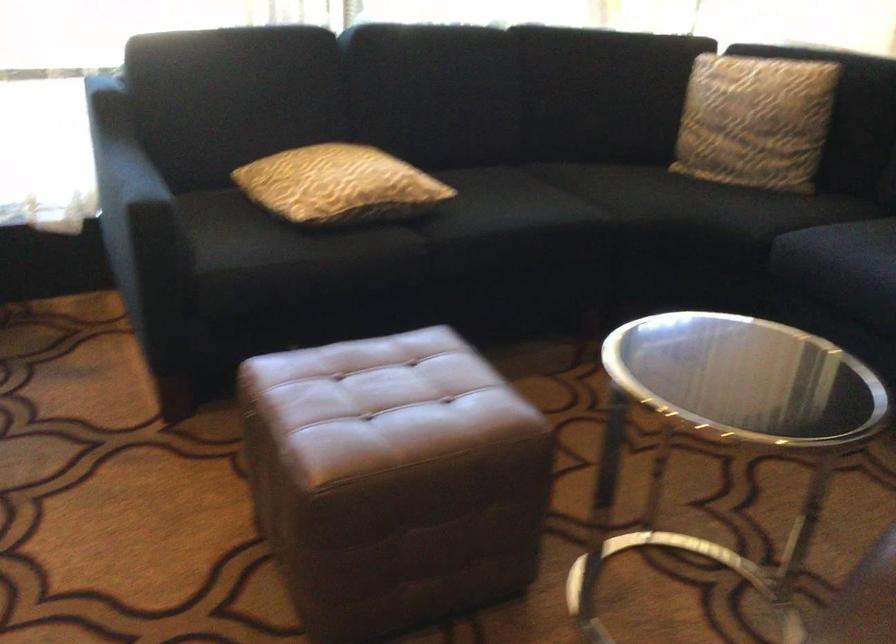
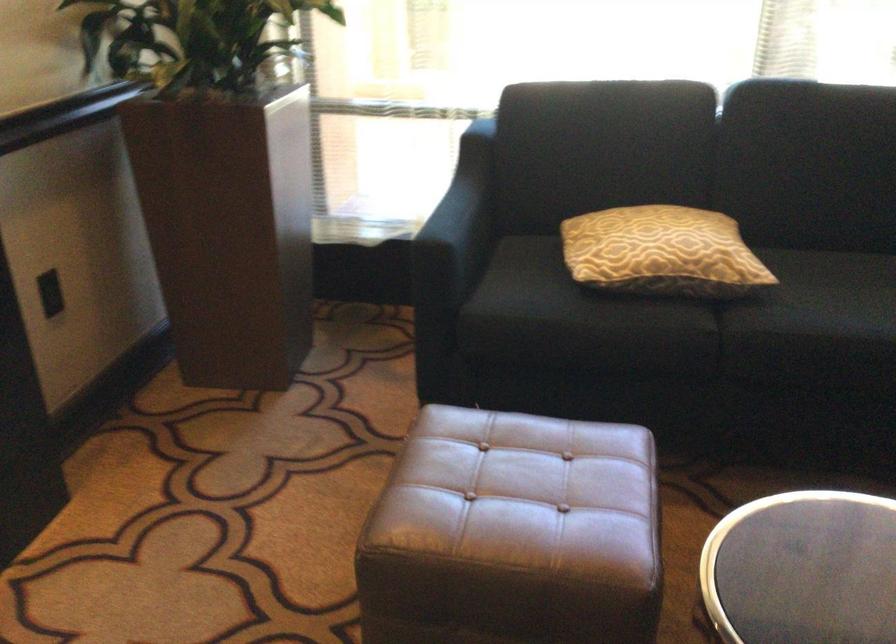
The point at [435,205] is marked in the first image. Where is the corresponding point in the second image?

(752, 289)